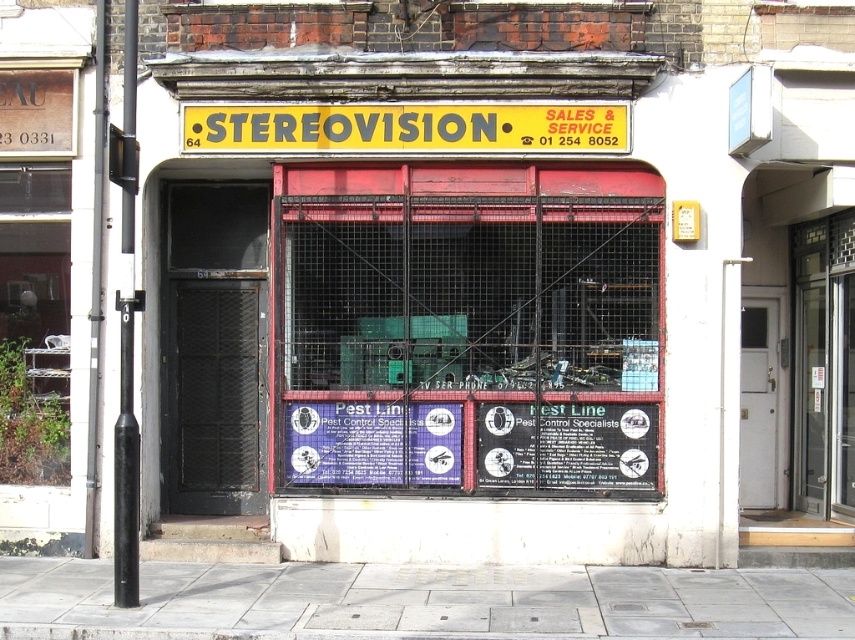
Is black matte sign at center wider than blue paper sign at center?

Yes.

Describe the element at coordinates (567, 445) in the screenshot. I see `black matte sign at center` at that location.

Identify the location of black matte sign at center. (567, 445).

Between gray concrete sidewalk at lower center and blue paper sign at center, which one has more height?

blue paper sign at center is taller.

Does point (164, 596) come behind point (433, 417)?

No.

You are a GUI agent. You are given a task and a screenshot of the screen. Output one action in this format:
    pyautogui.click(x=<x>, y=<y>)
    Task: Click on the gray concrete sidewalk at lower center
    The image size is (855, 640).
    Given the screenshot: What is the action you would take?
    pyautogui.click(x=419, y=602)

Based on the photo, which of these two, metal mesh cage at center or gray concrete sidewalk at lower center, stands shorter?

gray concrete sidewalk at lower center is shorter.

Between metal mesh cage at center and gray concrete sidewalk at lower center, which one is positioned higher?

metal mesh cage at center is higher up.

From the picture: Who is more distant from viewer, (467,248) or (158,602)?

The point (467,248) is more distant.

In order to click on metal mesh cage at center in this screenshot , I will do `click(469, 342)`.